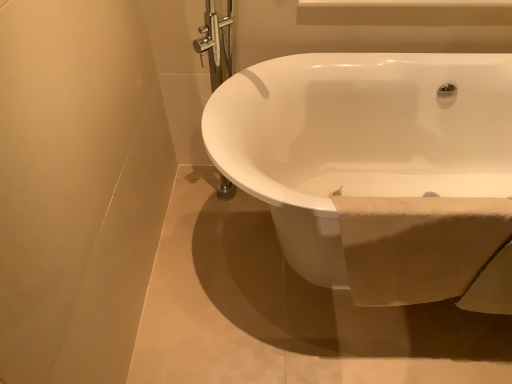
The height and width of the screenshot is (384, 512). Describe the element at coordinates (428, 250) in the screenshot. I see `white soft towel at lower right` at that location.

Where is `white soft towel at lower right`? The height and width of the screenshot is (384, 512). white soft towel at lower right is located at coordinates (428, 250).

This screenshot has width=512, height=384. What do you see at coordinates (359, 138) in the screenshot? I see `white glossy bathtub at center` at bounding box center [359, 138].

Identify the location of white glossy bathtub at center. (359, 138).

Identify the location of white soft towel at lower right. The height and width of the screenshot is (384, 512). (428, 250).

Which is more to the left, white glossy bathtub at center or white soft towel at lower right?

Positioned to the left is white soft towel at lower right.

Which object is closer to the camera taking this photo, white glossy bathtub at center or white soft towel at lower right?

white glossy bathtub at center is more forward.

Is point (396, 143) closer to camera compared to point (409, 265)?

No.

From the image's perspective, between white glossy bathtub at center and white soft towel at lower right, who is located below?

white soft towel at lower right.

From a real-world perspective, is white glossy bathtub at center above or below white soft towel at lower right?

From a real-world perspective, white glossy bathtub at center is physically below white soft towel at lower right.

Which of these two, white glossy bathtub at center or white soft towel at lower right, is thinner?

white soft towel at lower right is thinner.

Is white glossy bathtub at center shorter than white soft towel at lower right?

Incorrect, the height of white glossy bathtub at center does not fall short of that of white soft towel at lower right.

Is white glossy bathtub at center smaller than white soft towel at lower right?

Incorrect, white glossy bathtub at center is not smaller in size than white soft towel at lower right.

Is white glossy bathtub at center not within white soft towel at lower right?

Yes, white glossy bathtub at center is located beyond the bounds of white soft towel at lower right.

Would you say white glossy bathtub at center is a long distance from white soft towel at lower right?

That's not correct — white glossy bathtub at center is a little close to white soft towel at lower right.

Could you tell me if white glossy bathtub at center is turned towards white soft towel at lower right?

Yes, white glossy bathtub at center is oriented towards white soft towel at lower right.

Can you tell me how much white glossy bathtub at center and white soft towel at lower right differ in facing direction?

There is a 0.00864-degree angle between the facing directions of white glossy bathtub at center and white soft towel at lower right.

Locate an element on the screen. This screenshot has width=512, height=384. toilet paper above the white glossy bathtub at center (from a real-world perspective) is located at coordinates (428, 250).

Based on the photo, which is more to the left, white soft towel at lower right or white glossy bathtub at center?

Positioned to the left is white soft towel at lower right.

Which object is more forward, white soft towel at lower right or white glossy bathtub at center?

white glossy bathtub at center.

Is point (403, 217) positioned before point (259, 110)?

Yes.

From the image's perspective, who appears lower, white soft towel at lower right or white glossy bathtub at center?

white soft towel at lower right, from the image's perspective.

From a real-world perspective, which object rests below the other?

In real-world perspective, white glossy bathtub at center is lower.

Is white soft towel at lower right wider or thinner than white glossy bathtub at center?

Considering their sizes, white soft towel at lower right looks slimmer than white glossy bathtub at center.

Based on the photo, is white soft towel at lower right shorter than white glossy bathtub at center?

Indeed, white soft towel at lower right has a lesser height compared to white glossy bathtub at center.

Does white soft towel at lower right have a larger size compared to white glossy bathtub at center?

No, white soft towel at lower right is not bigger than white glossy bathtub at center.

Is white glossy bathtub at center inside white soft towel at lower right?

No, white glossy bathtub at center is not surrounded by white soft towel at lower right.

Is white soft towel at lower right far away from white glossy bathtub at center?

No.

Is white soft towel at lower right oriented away from white glossy bathtub at center?

Yes, white soft towel at lower right is facing away from white glossy bathtub at center.

Measure the distance between white soft towel at lower right and white glossy bathtub at center.

white soft towel at lower right and white glossy bathtub at center are 14.85 inches apart.

Where is `toilet paper above the white glossy bathtub at center (from a real-world perspective)`? toilet paper above the white glossy bathtub at center (from a real-world perspective) is located at coordinates (428, 250).

Locate an element on the screen. bathtub on the right side of white soft towel at lower right is located at coordinates (359, 138).

Where is `toilet paper lying below the white glossy bathtub at center (from the image's perspective)`? The width and height of the screenshot is (512, 384). toilet paper lying below the white glossy bathtub at center (from the image's perspective) is located at coordinates (428, 250).